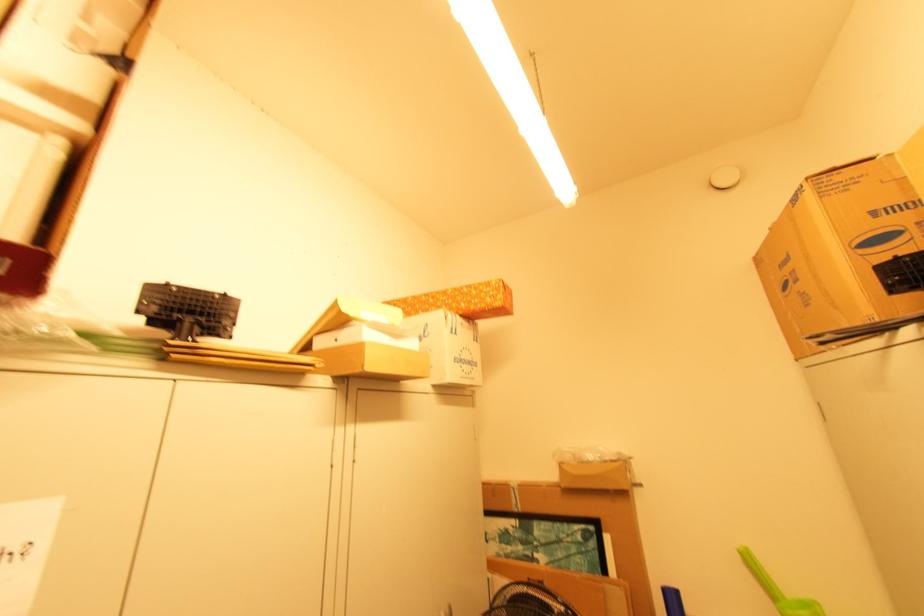
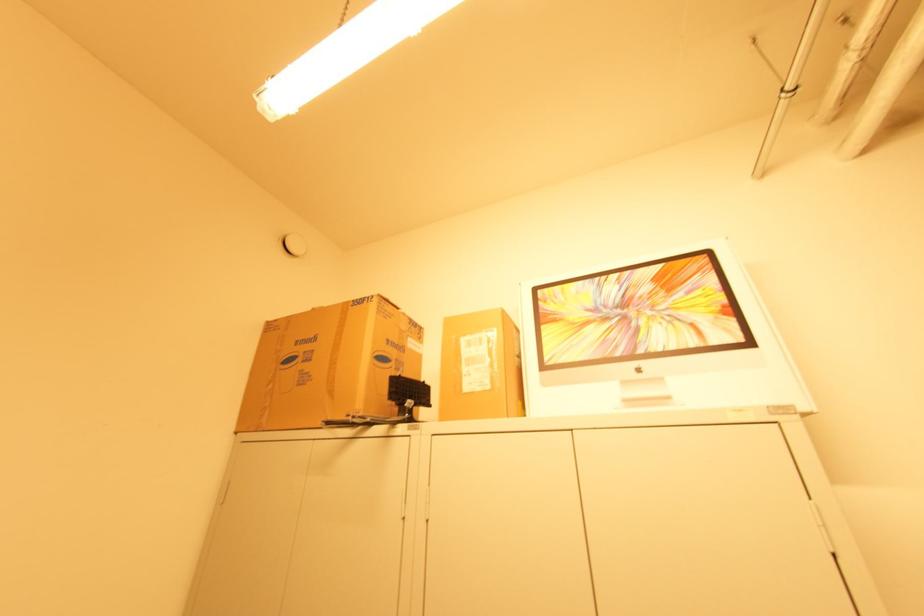
In the second image, find the point that corresponds to pixel 772 229 in the first image.

(315, 309)